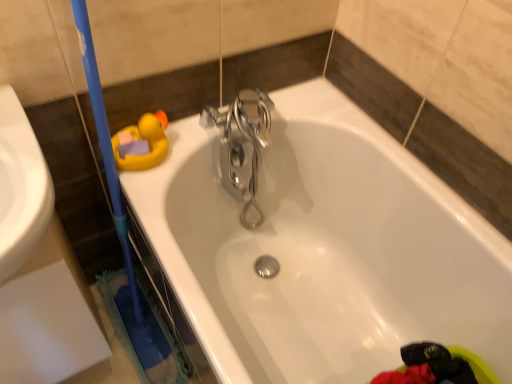
Question: In terms of width, does white glossy bathtub at upper center look wider or thinner when compared to polished chrome faucet at center?

Choices:
 (A) wide
 (B) thin

Answer: (A)

Question: From the image's perspective, is white glossy bathtub at upper center above or below polished chrome faucet at center?

Choices:
 (A) below
 (B) above

Answer: (A)

Question: Based on their positions, is white glossy bathtub at upper center located to the left or right of polished chrome faucet at center?

Choices:
 (A) left
 (B) right

Answer: (B)

Question: Is polished chrome faucet at center bigger or smaller than white glossy bathtub at upper center?

Choices:
 (A) small
 (B) big

Answer: (A)

Question: In terms of width, does polished chrome faucet at center look wider or thinner when compared to white glossy bathtub at upper center?

Choices:
 (A) thin
 (B) wide

Answer: (A)

Question: Is point (250, 187) closer or farther from the camera than point (193, 226)?

Choices:
 (A) farther
 (B) closer

Answer: (A)

Question: From the image's perspective, relative to white glossy bathtub at upper center, is polished chrome faucet at center above or below?

Choices:
 (A) below
 (B) above

Answer: (B)